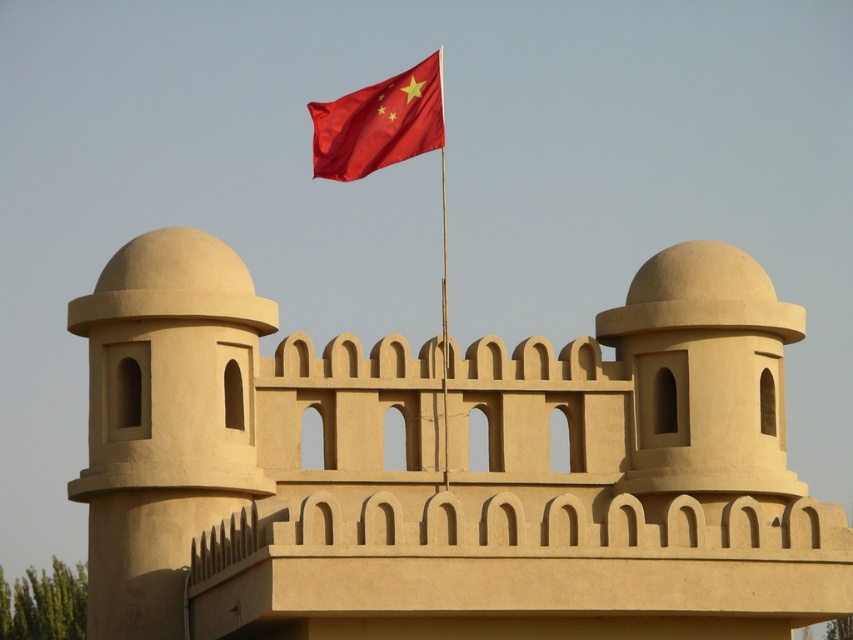
Question: Which object appears closest to the camera in this image?

Choices:
 (A) matte beige tower at left
 (B) smooth red flag at upper center

Answer: (A)

Question: Is beige stone fort at center to the left of smooth red flag at upper center from the viewer's perspective?

Choices:
 (A) no
 (B) yes

Answer: (B)

Question: Among these points, which one is nearest to the camera?

Choices:
 (A) (430, 116)
 (B) (726, 452)

Answer: (A)

Question: Where is beige stone fort at center located in relation to smooth red flag at upper center in the image?

Choices:
 (A) above
 (B) below

Answer: (B)

Question: Which point is farther to the camera?

Choices:
 (A) (350, 150)
 (B) (242, 262)
 (C) (183, 452)

Answer: (B)

Question: Is beige stone fort at center positioned in front of matte beige tower at left?

Choices:
 (A) yes
 (B) no

Answer: (A)